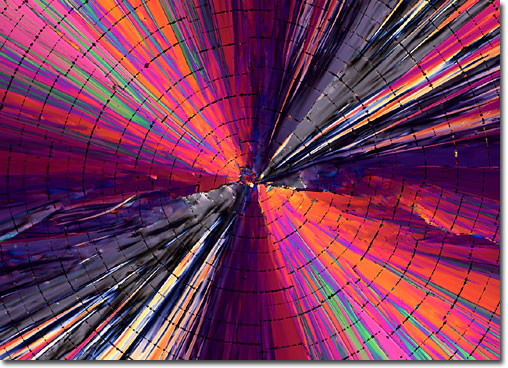
Where is `color wheel artwork`? This screenshot has width=508, height=368. color wheel artwork is located at coordinates point(304,222).